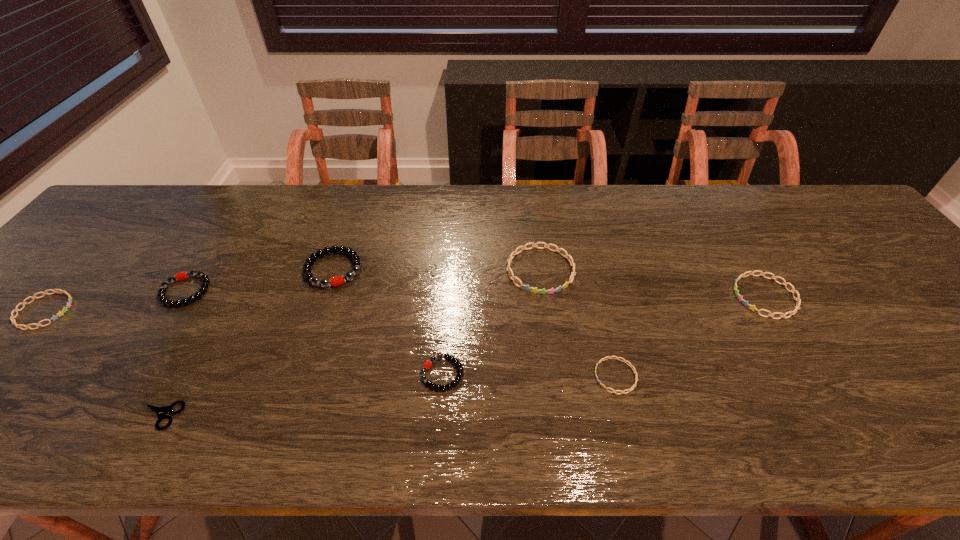
Where is `the biggest blue bracelet`? The image size is (960, 540). the biggest blue bracelet is located at coordinates (526, 287).

The image size is (960, 540). Find the location of `the fifth bracelet from right to left`. the fifth bracelet from right to left is located at coordinates (307, 266).

The width and height of the screenshot is (960, 540). What are the coordinates of `the biggest black bracelet` in the screenshot? It's located at (307, 266).

You are a GUI agent. You are given a task and a screenshot of the screen. Output one action in this format:
    pyautogui.click(x=<x>, y=<y>)
    Task: Click on the rightmost blue bracelet
    This screenshot has height=540, width=960.
    Given the screenshot: What is the action you would take?
    pyautogui.click(x=793, y=291)

This screenshot has height=540, width=960. What are the coordinates of `the second biggest blue bracelet` in the screenshot? It's located at (793, 291).

Locate an element on the screen. the leftmost black bracelet is located at coordinates (161, 295).

The width and height of the screenshot is (960, 540). Find the location of `the second bracelet from left to right`. the second bracelet from left to right is located at coordinates (161, 295).

Find the location of `the leftmost object`. the leftmost object is located at coordinates (44, 293).

Image resolution: width=960 pixels, height=540 pixels. Find the location of `the leftmost blue bracelet`. the leftmost blue bracelet is located at coordinates (44, 293).

I want to click on the fourth bracelet from right to left, so click(427, 365).